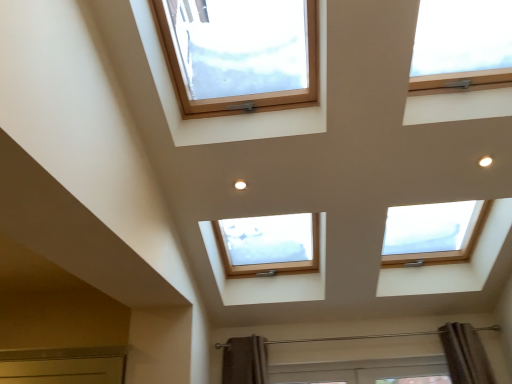
Question: In terms of height, does clear glass window at upper left, the 2th window when ordered from right to left, look taller or shorter compared to natural wood window at upper right, the first window in the right-to-left sequence?

Choices:
 (A) short
 (B) tall

Answer: (B)

Question: From the image's perspective, relative to natural wood window at upper right, the first window in the right-to-left sequence, is clear glass window at upper left, the first window from the left, above or below?

Choices:
 (A) below
 (B) above

Answer: (A)

Question: Considering the relative positions of clear glass window at upper left, the first window from the left, and natural wood window at upper right, the first window in the right-to-left sequence, in the image provided, is clear glass window at upper left, the first window from the left, to the left or to the right of natural wood window at upper right, the first window in the right-to-left sequence,?

Choices:
 (A) left
 (B) right

Answer: (A)

Question: From the image's perspective, relative to clear glass window at upper left, the first window from the left, is natural wood window at upper right, which appears as the 2th window when viewed from the left, above or below?

Choices:
 (A) below
 (B) above

Answer: (B)

Question: From their relative heights in the image, would you say natural wood window at upper right, the first window in the right-to-left sequence, is taller or shorter than clear glass window at upper left, the first window from the left?

Choices:
 (A) short
 (B) tall

Answer: (A)

Question: Is natural wood window at upper right, which appears as the 2th window when viewed from the left, bigger or smaller than clear glass window at upper left, the 2th window when ordered from right to left?

Choices:
 (A) big
 (B) small

Answer: (B)

Question: Is natural wood window at upper right, the first window in the right-to-left sequence, wider or thinner than clear glass window at upper left, the first window from the left?

Choices:
 (A) thin
 (B) wide

Answer: (A)